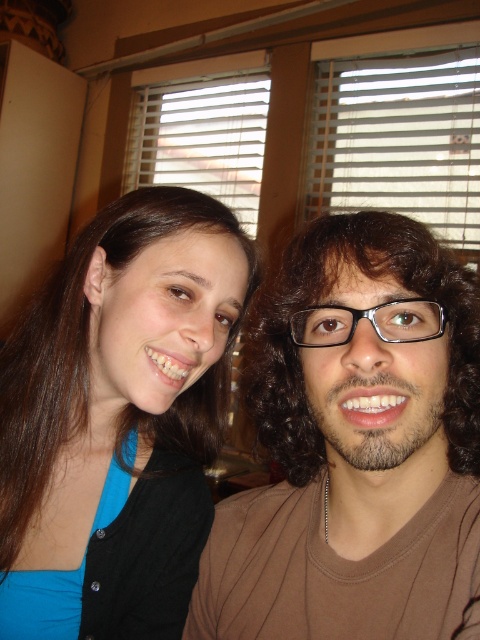
In the scene shown: Does brown matte shirt at center appear on the right side of blue fabric shirt at upper left?

Yes, brown matte shirt at center is to the right of blue fabric shirt at upper left.

How far apart are brown matte shirt at center and blue fabric shirt at upper left?

They are 5.57 inches apart.

Is point (319, 280) closer to camera compared to point (112, 426)?

Yes, point (319, 280) is closer to viewer.

Locate an element on the screen. The height and width of the screenshot is (640, 480). brown matte shirt at center is located at coordinates (356, 445).